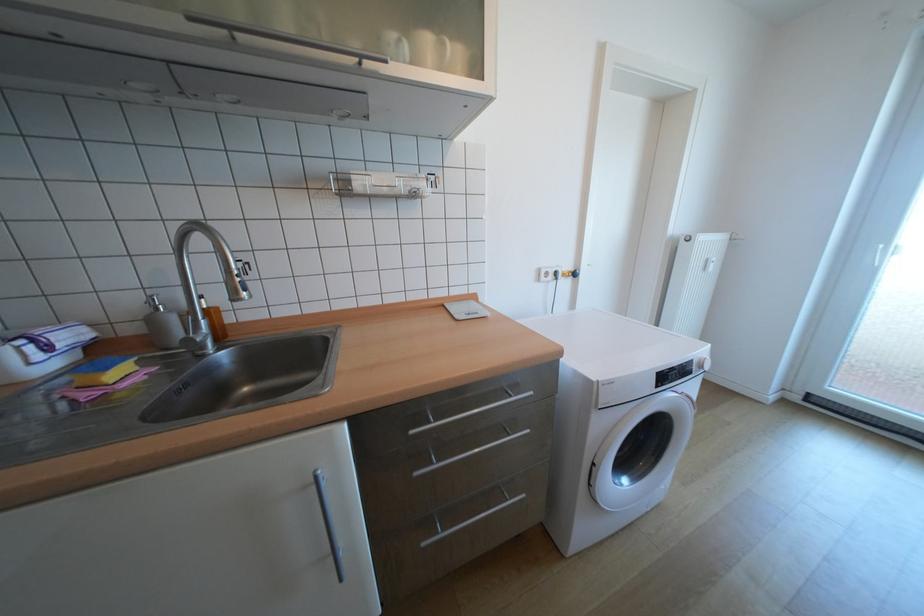
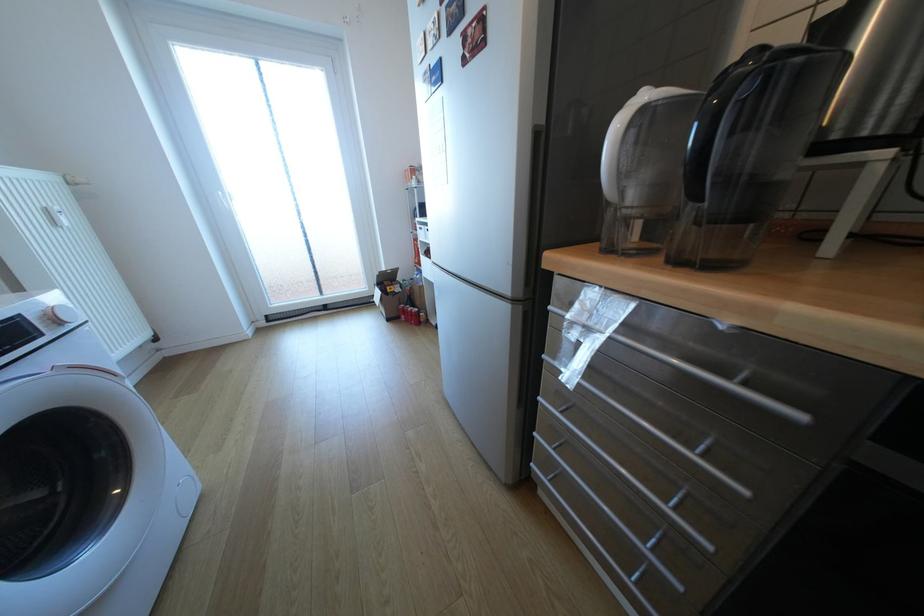
Find the pixel in the second image that matches point (817, 394) in the first image.

(275, 315)